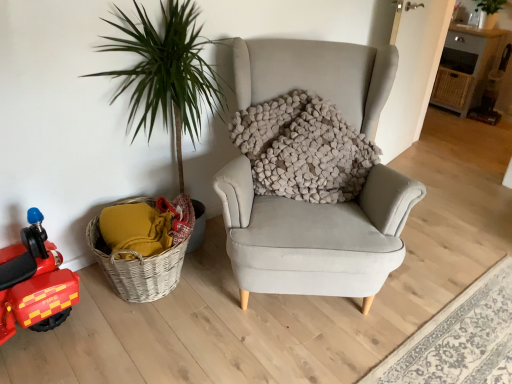
Question: Is shiny red plastic toy car at left oriented towards light gray fabric rug at lower right?

Choices:
 (A) yes
 (B) no

Answer: (B)

Question: Considering the relative sizes of shiny red plastic toy car at left and light gray fabric rug at lower right in the image provided, is shiny red plastic toy car at left thinner than light gray fabric rug at lower right?

Choices:
 (A) yes
 (B) no

Answer: (A)

Question: Does shiny red plastic toy car at left have a lesser height compared to light gray fabric rug at lower right?

Choices:
 (A) yes
 (B) no

Answer: (B)

Question: Considering the relative positions of shiny red plastic toy car at left and light gray fabric rug at lower right in the image provided, is shiny red plastic toy car at left to the right of light gray fabric rug at lower right from the viewer's perspective?

Choices:
 (A) yes
 (B) no

Answer: (B)

Question: Can you confirm if shiny red plastic toy car at left is bigger than light gray fabric rug at lower right?

Choices:
 (A) no
 (B) yes

Answer: (B)

Question: Does shiny red plastic toy car at left appear on the left side of light gray fabric rug at lower right?

Choices:
 (A) yes
 (B) no

Answer: (A)

Question: Can you confirm if shiny red plastic toy car at left is taller than woven wood table at upper right?

Choices:
 (A) yes
 (B) no

Answer: (B)

Question: Can we say shiny red plastic toy car at left lies outside woven wood table at upper right?

Choices:
 (A) no
 (B) yes

Answer: (B)

Question: From a real-world perspective, is shiny red plastic toy car at left positioned under woven wood table at upper right based on gravity?

Choices:
 (A) no
 (B) yes

Answer: (B)

Question: Can you confirm if shiny red plastic toy car at left is bigger than woven wood table at upper right?

Choices:
 (A) no
 (B) yes

Answer: (A)

Question: Is shiny red plastic toy car at left oriented towards woven wood table at upper right?

Choices:
 (A) yes
 (B) no

Answer: (B)

Question: Does shiny red plastic toy car at left touch woven wood table at upper right?

Choices:
 (A) no
 (B) yes

Answer: (A)

Question: Is light gray fabric rug at lower right taller than woven wood table at upper right?

Choices:
 (A) yes
 (B) no

Answer: (B)